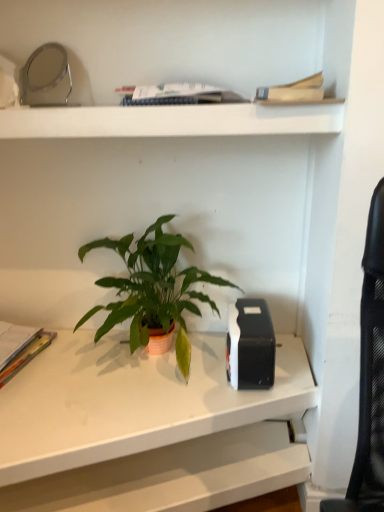
Question: Considering the relative sizes of hardcover book at upper center, the 1th paperback book viewed from the top, and green matte houseplant at center in the image provided, is hardcover book at upper center, the 1th paperback book viewed from the top, taller than green matte houseplant at center?

Choices:
 (A) yes
 (B) no

Answer: (B)

Question: Is hardcover book at upper center, the second paperback book in the bottom-to-top sequence, at the left side of green matte houseplant at center?

Choices:
 (A) yes
 (B) no

Answer: (B)

Question: Is hardcover book at upper center, the second paperback book in the bottom-to-top sequence, positioned behind green matte houseplant at center?

Choices:
 (A) yes
 (B) no

Answer: (B)

Question: Could you tell me if hardcover book at upper center, the second paperback book in the bottom-to-top sequence, is turned towards green matte houseplant at center?

Choices:
 (A) no
 (B) yes

Answer: (A)

Question: From the image's perspective, is hardcover book at upper center, which is the first paperback book from front to back, over green matte houseplant at center?

Choices:
 (A) no
 (B) yes

Answer: (B)

Question: From the image's perspective, is green matte houseplant at center above or below white matte desk at center?

Choices:
 (A) below
 (B) above

Answer: (B)

Question: Considering their positions, is green matte houseplant at center located in front of or behind white matte desk at center?

Choices:
 (A) behind
 (B) front

Answer: (A)

Question: In terms of width, does green matte houseplant at center look wider or thinner when compared to white matte desk at center?

Choices:
 (A) wide
 (B) thin

Answer: (B)

Question: Is green matte houseplant at center situated inside white matte desk at center or outside?

Choices:
 (A) inside
 (B) outside

Answer: (B)

Question: Based on their positions, is white matte shelf at upper center located to the left or right of white matte desk at center?

Choices:
 (A) left
 (B) right

Answer: (B)

Question: From the image's perspective, is white matte shelf at upper center above or below white matte desk at center?

Choices:
 (A) above
 (B) below

Answer: (A)

Question: Is white matte shelf at upper center spatially inside white matte desk at center, or outside of it?

Choices:
 (A) inside
 (B) outside

Answer: (B)

Question: Based on their sizes in the image, would you say white matte shelf at upper center is bigger or smaller than white matte desk at center?

Choices:
 (A) big
 (B) small

Answer: (B)

Question: Considering the positions of multicolored paper at left, which is counted as the first paperback book, starting from the left, and white matte desk at center in the image, is multicolored paper at left, which is counted as the first paperback book, starting from the left, taller or shorter than white matte desk at center?

Choices:
 (A) short
 (B) tall

Answer: (A)

Question: Is point (11, 359) positioned closer to the camera than point (278, 400)?

Choices:
 (A) farther
 (B) closer

Answer: (A)